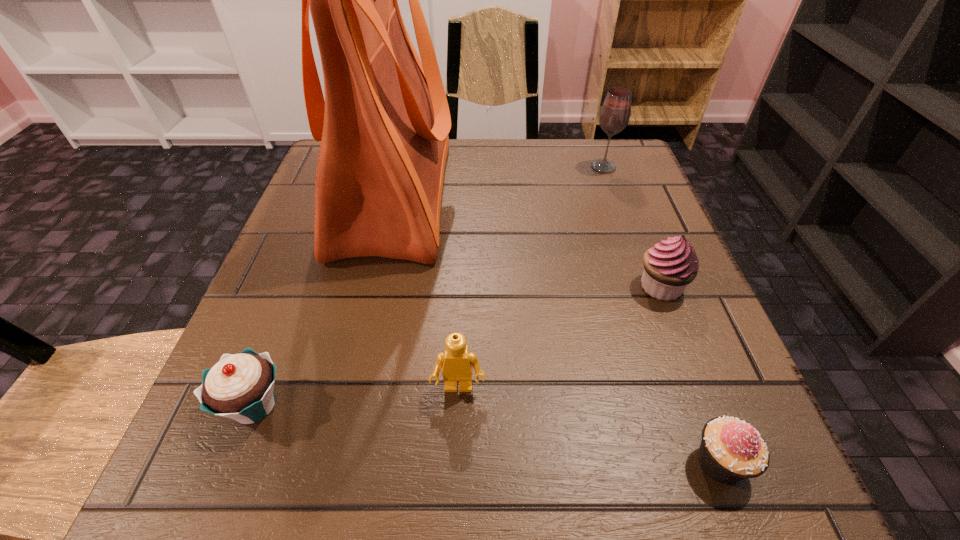
Where is `blank space at the near edge of the desktop`? Image resolution: width=960 pixels, height=540 pixels. blank space at the near edge of the desktop is located at coordinates (386, 486).

In the image, there is a desktop. Where is `vacant space at the left edge`? vacant space at the left edge is located at coordinates (318, 356).

Locate an element on the screen. blank space at the right edge of the desktop is located at coordinates (663, 370).

Image resolution: width=960 pixels, height=540 pixels. In the image, there is a desktop. What are the coordinates of `vacant region at the near left corner` in the screenshot? It's located at (198, 440).

Locate an element on the screen. free point at the far right corner is located at coordinates (584, 150).

The height and width of the screenshot is (540, 960). In order to click on blank space at the near right corner in this screenshot , I will do `click(783, 492)`.

Find the location of a particular element. The image size is (960, 540). free space between the leftmost cupcake and the tallest object is located at coordinates (324, 300).

What are the coordinates of `free spot between the Lego and the leftmost cupcake` in the screenshot? It's located at (356, 397).

The image size is (960, 540). What are the coordinates of `vacant area between the farthest cupcake and the glass drink container` in the screenshot? It's located at (632, 227).

At what (x,y) coordinates should I click in order to perform the action: click on empty location between the tallest cupcake and the tallest object. Please return your answer as a coordinate pair (x, y). This screenshot has height=540, width=960. Looking at the image, I should click on (527, 241).